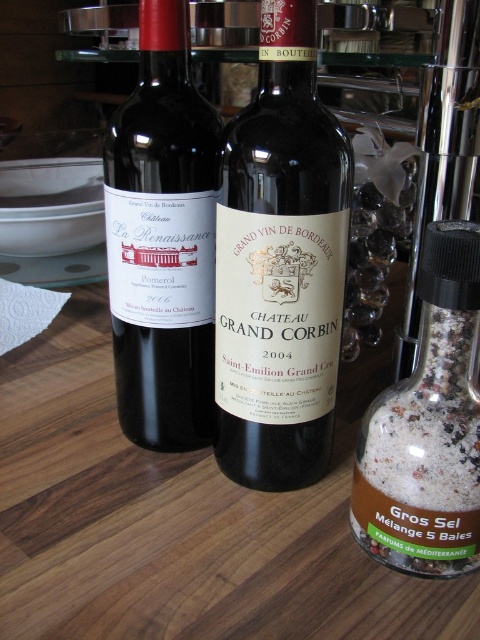
You are a wine collector who wants to place a third matte black bottle between the existing two bottles. Given that the space between the matte black bottle at center and the matte black bottle at left is 1.84 inches, can you fit the third bottle without moving the existing ones?

The distance between the matte black bottle at center and the matte black bottle at left is 1.84 inches. Since the third bottle would require additional space to fit between them, and the existing gap is only 1.84 inches, it is unlikely there is enough room to place another bottle without moving the existing ones.

Consider the image. You are a wine connoisseur standing at the edge of a wooden table where two wine bottles are placed. You want to reach for the closer bottle. Which point should you aim for, point at (x=278, y=284) or point at (x=374, y=413)?

Point at (x=278, y=284) is closer to you than point at (x=374, y=413), so you should aim for point at (x=278, y=284) to reach the closer bottle.

You are a bartender preparing a drink and need to grab the salt. You see the matte black bottle at center and the white granular salt at right. Which one is positioned to the right?

The white granular salt at right is positioned to the right of the matte black bottle at center.